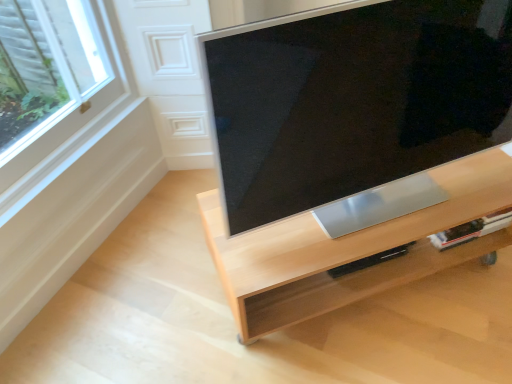
This screenshot has width=512, height=384. What are the coordinates of `free point above light wood tv stand at center (from a real-world perspective)` in the screenshot? It's located at (376, 216).